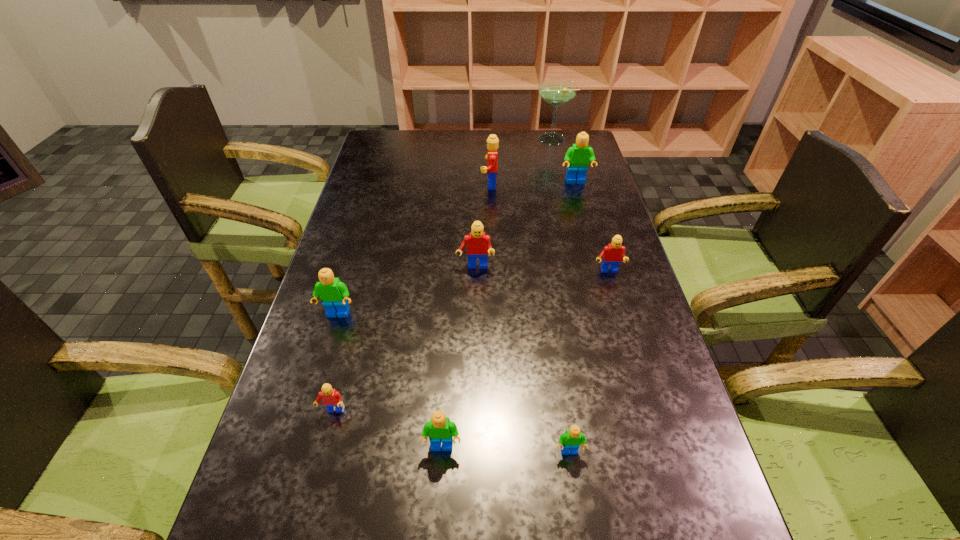
Locate an element on the screen. the second green Lego from right to left is located at coordinates (571, 440).

Locate an element on the screen. the smallest green Lego is located at coordinates (571, 440).

Where is `the leftmost red Lego`? The height and width of the screenshot is (540, 960). the leftmost red Lego is located at coordinates (331, 397).

This screenshot has width=960, height=540. Find the location of `the sixth farthest Lego`. the sixth farthest Lego is located at coordinates (331, 397).

Identify the location of vacant space located on the front of the tallest object. The image size is (960, 540). (557, 166).

At what (x,y) coordinates should I click in order to perform the action: click on vacant space located 0.360m on the front-facing side of the farthest red Lego. Please return your answer as a coordinate pair (x, y). Looking at the image, I should click on (376, 183).

Identify the location of free space located on the front-facing side of the farthest red Lego. (385, 183).

Locate an element on the screen. free space located on the front-facing side of the farthest red Lego is located at coordinates (373, 183).

What are the coordinates of `vacant region located on the face of the biggest green Lego` in the screenshot? It's located at [x=586, y=217].

You are a GUI agent. You are given a task and a screenshot of the screen. Output one action in this format:
    pyautogui.click(x=<x>, y=<y>)
    Task: Click on the vacant area situated on the face of the leftmost green Lego
    The image size is (960, 540).
    Given the screenshot: What is the action you would take?
    coord(324,359)